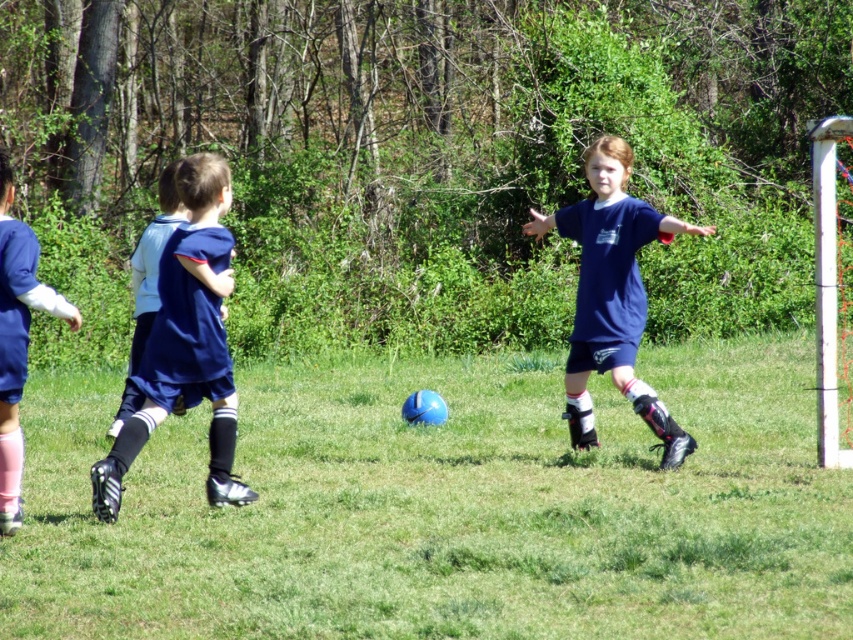
Looking at this image, you are a soccer coach observing the game. You notice two players wearing dark blue jersey at center and blue jersey at left. Which player should you instruct to reach a ball that is rolling towards the center of the field first, based on their positions?

The dark blue jersey at center is closer to the center of the field, so you should instruct them to reach the ball first.

You are a soccer coach observing the game. You notice two players wearing dark blue jersey at center and blue jersey at left. Which player is positioned higher in the image?

The dark blue jersey at center is positioned higher than the blue jersey at left in the image.